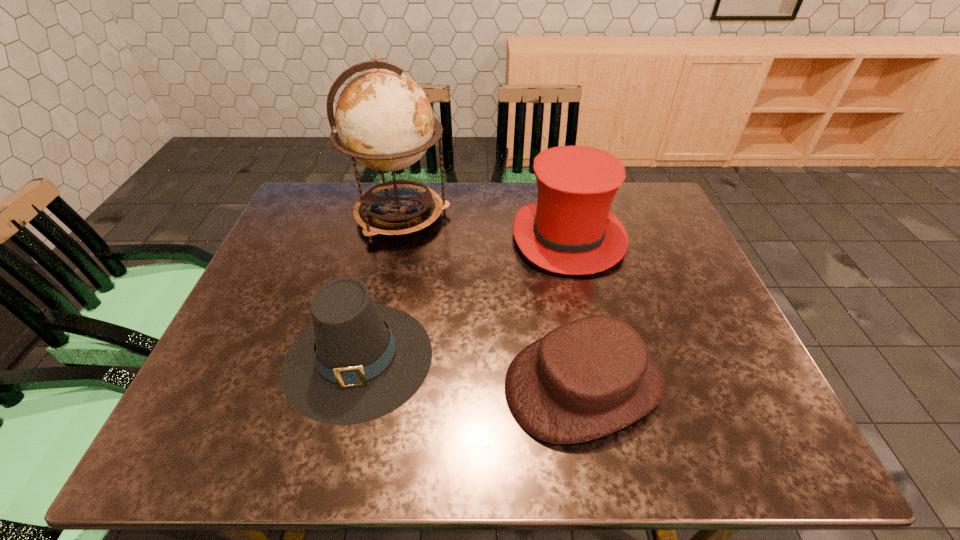
Image resolution: width=960 pixels, height=540 pixels. I want to click on free area in between the tallest object and the shortest object, so click(x=492, y=300).

Identify the location of empty location between the shortest hat and the globe. Image resolution: width=960 pixels, height=540 pixels. (492, 300).

I want to click on free space between the leftmost hat and the globe, so click(379, 287).

You are a GUI agent. You are given a task and a screenshot of the screen. Output one action in this format:
    pyautogui.click(x=<x>, y=<y>)
    Task: Click on the unoccupied area between the globe and the tallest hat
    
    Given the screenshot: What is the action you would take?
    pyautogui.click(x=485, y=227)

Locate an element on the screen. The image size is (960, 540). free spot between the tallest object and the leftmost hat is located at coordinates (379, 287).

At what (x,y) coordinates should I click in order to perform the action: click on free area in between the second tallest hat and the globe. Please return your answer as a coordinate pair (x, y). Looking at the image, I should click on [x=379, y=287].

Find the location of a particular element. This screenshot has height=540, width=960. free spot between the second tallest hat and the shortest object is located at coordinates (471, 370).

You are a GUI agent. You are given a task and a screenshot of the screen. Output one action in this format:
    pyautogui.click(x=<x>, y=<y>)
    Task: Click on the vacant space that's between the farthest hat and the shortest hat
    
    Given the screenshot: What is the action you would take?
    pyautogui.click(x=576, y=310)

This screenshot has width=960, height=540. I want to click on vacant point located between the tallest hat and the shortest object, so click(x=576, y=310).

You are a GUI agent. You are given a task and a screenshot of the screen. Output one action in this format:
    pyautogui.click(x=<x>, y=<y>)
    Task: Click on the free space that is in between the tallest hat and the tallest object
    This screenshot has height=540, width=960.
    Given the screenshot: What is the action you would take?
    pyautogui.click(x=485, y=227)